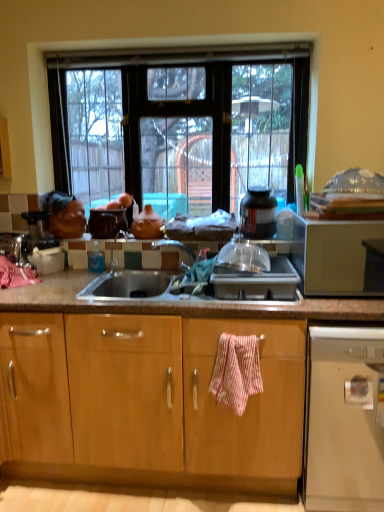
Question: Is white plastic dishwasher at lower right in front of or behind pink striped towel at center in the image?

Choices:
 (A) behind
 (B) front

Answer: (B)

Question: Considering the positions of white plastic dishwasher at lower right and pink striped towel at center in the image, is white plastic dishwasher at lower right taller or shorter than pink striped towel at center?

Choices:
 (A) short
 (B) tall

Answer: (B)

Question: Which is nearer to the brown matte pot at center, the second appliance in the right-to-left sequence?

Choices:
 (A) matte clay pot at center
 (B) transparent glass window at center
 (C) satin gold microwave at right
 (D) black plastic container at upper center, the 1th appliance when ordered from right to left
 (E) satin silver gas stove at center

Answer: (A)

Question: Which object is positioned closest to the white plastic dishwasher at lower right?

Choices:
 (A) matte clay pot at center
 (B) satin gold microwave at right
 (C) satin silver gas stove at center
 (D) pink striped towel at center
 (E) brown matte pot at center, positioned as the first appliance in left-to-right order

Answer: (D)